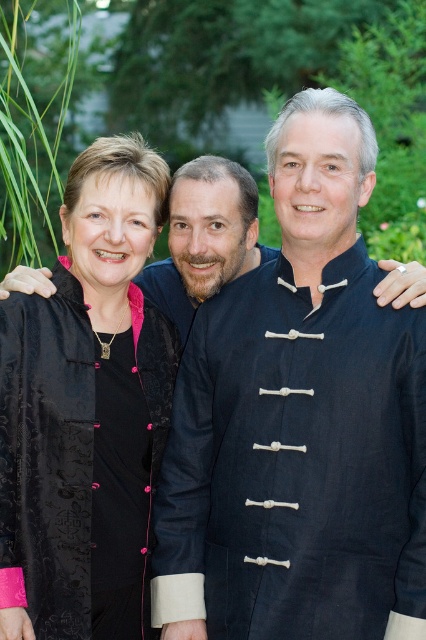
You are a fashion designer observing the three people in the garden. You notice the dark blue fabric robe at center and the matte black shirt at center. Which clothing item is taller?

The dark blue fabric robe at center is taller than the matte black shirt at center.

You are standing in a garden and want to reach a point marked at coordinates point (344, 371). If your current position is 10 feet away from this point, how much further do you need to walk to reach it?

The distance of point (344, 371) from viewer is 12.65 feet. Since you are currently 10 feet away, you need to walk an additional 2.65 feet to reach the point.

You are a fashion designer observing the three people in the image. You need to determine which of the two black clothing items, the black satin blouse at left or the matte black shirt at center, would require more fabric to create. Based on the visual information provided, which one would you choose?

The black satin blouse at left is larger in size than the matte black shirt at center, so it would require more fabric to create.